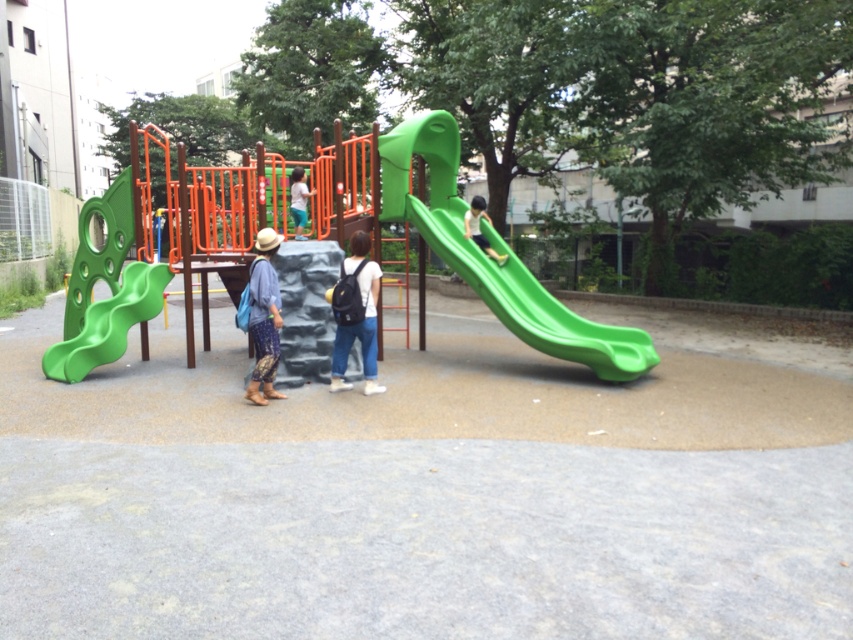
Does green matte slide at left have a larger size compared to green matte slide at right?

No, green matte slide at left is not bigger than green matte slide at right.

Between green matte slide at left and green matte slide at right, which one has more height?

green matte slide at right is taller.

Is point (76, 365) farther from viewer compared to point (465, 212)?

No, (76, 365) is closer to viewer.

Find the location of `green matte slide at left`. green matte slide at left is located at coordinates pyautogui.click(x=108, y=323).

Is point (556, 316) closer to viewer compared to point (364, 349)?

No.

Is green plastic slide at center shorter than black fabric backpack at center?

No, green plastic slide at center is not shorter than black fabric backpack at center.

You are a GUI agent. You are given a task and a screenshot of the screen. Output one action in this format:
    pyautogui.click(x=<x>, y=<y>)
    Task: Click on the green plastic slide at center
    
    Given the screenshot: What is the action you would take?
    pyautogui.click(x=492, y=260)

What do you see at coordinates (492, 260) in the screenshot? I see `green plastic slide at center` at bounding box center [492, 260].

Looking at this image, can you confirm if green plastic slide at center is positioned to the right of blue fabric bag at center?

Yes, green plastic slide at center is to the right of blue fabric bag at center.

The image size is (853, 640). Find the location of `green plastic slide at center`. green plastic slide at center is located at coordinates (492, 260).